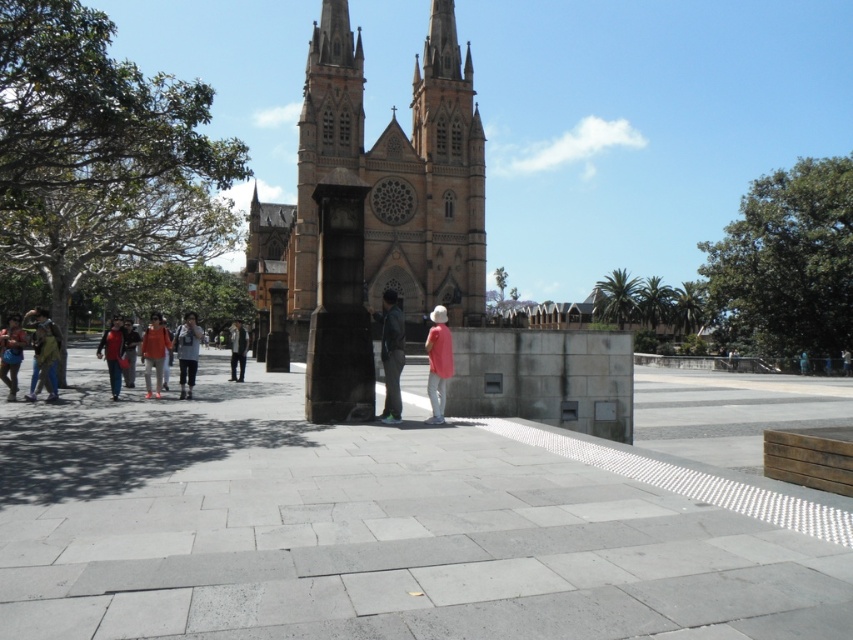
You are a photographer trying to capture a group photo of the people wearing the dark green jacket at center and the matte orange jacket at center left. If you want to ensure both jackets are fully visible in the frame, which jacket should you position closer to the camera to avoid cropping?

The dark green jacket at center should be positioned closer to the camera because it is narrower than the matte orange jacket at center left, allowing it to fit within the frame more easily while accommodating the wider matte orange jacket at center left.

You are standing at the point marked as point (409, 518) in the public square. What is the material of the surface you are currently standing on?

The point (409, 518) corresponds to the gray concrete plaza at center, so the material is concrete.

You are standing in the public square and want to take a photo of the historic church in the background. There is a point at coordinates point (x=387, y=353) that is 91.16 meters away from you. If you move closer to this point, will the church appear larger in your photo?

Moving closer to the point at coordinates point (x=387, y=353), which is 91.16 meters away, will decrease your distance from the church. Since the church is in the background, moving closer to the point would also bring you closer to the church, making it appear larger in your photo.